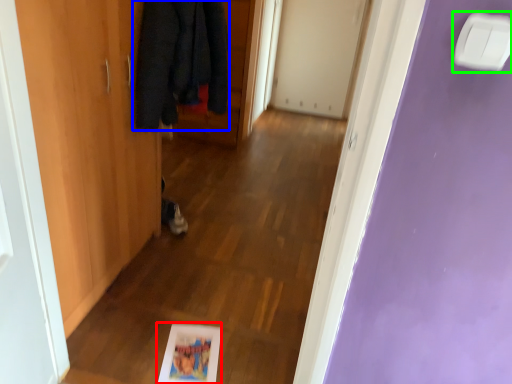
Question: Which is farther away from picture frame (highlighted by a red box)? cloak (highlighted by a blue box) or light switch (highlighted by a green box)?

Choices:
 (A) cloak
 (B) light switch

Answer: (B)